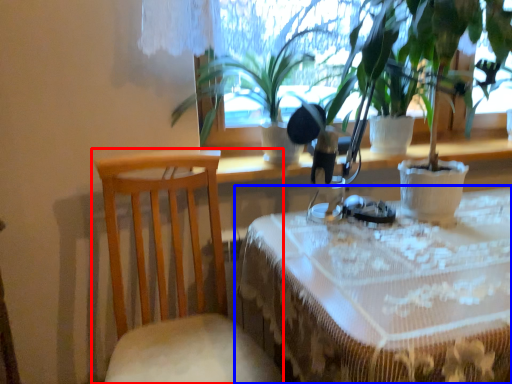
Question: Which of the following is the farthest to the observer, chair (highlighted by a red box) or table (highlighted by a blue box)?

Choices:
 (A) chair
 (B) table

Answer: (A)